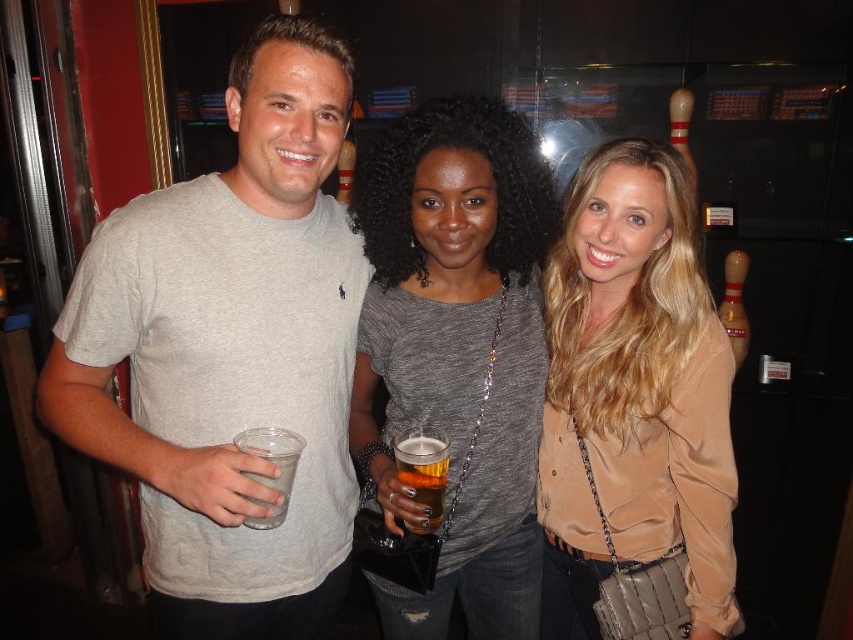
Is matte gray shirt at center smaller than satin beige blouse at center?

Incorrect, matte gray shirt at center is not smaller in size than satin beige blouse at center.

Does matte gray shirt at center have a greater height compared to satin beige blouse at center?

Yes, matte gray shirt at center is taller than satin beige blouse at center.

Does point (386, 483) lie behind point (567, 573)?

No, it is not.

I want to click on matte gray shirt at center, so click(456, 353).

Measure the distance between gray t-shirt at left and translucent plastic cup at center.

33.74 centimeters

What do you see at coordinates (229, 353) in the screenshot? The height and width of the screenshot is (640, 853). I see `gray t-shirt at left` at bounding box center [229, 353].

Where is `gray t-shirt at left`? This screenshot has height=640, width=853. gray t-shirt at left is located at coordinates (229, 353).

Is matte gray shirt at center below translucent plastic cup at center?

→ No, matte gray shirt at center is not below translucent plastic cup at center.

Between matte gray shirt at center and translucent plastic cup at center, which one appears on the right side from the viewer's perspective?

matte gray shirt at center is more to the right.

Is point (387, 209) closer to viewer compared to point (436, 522)?

No, it is behind (436, 522).

Locate an element on the screen. This screenshot has width=853, height=640. matte gray shirt at center is located at coordinates (456, 353).